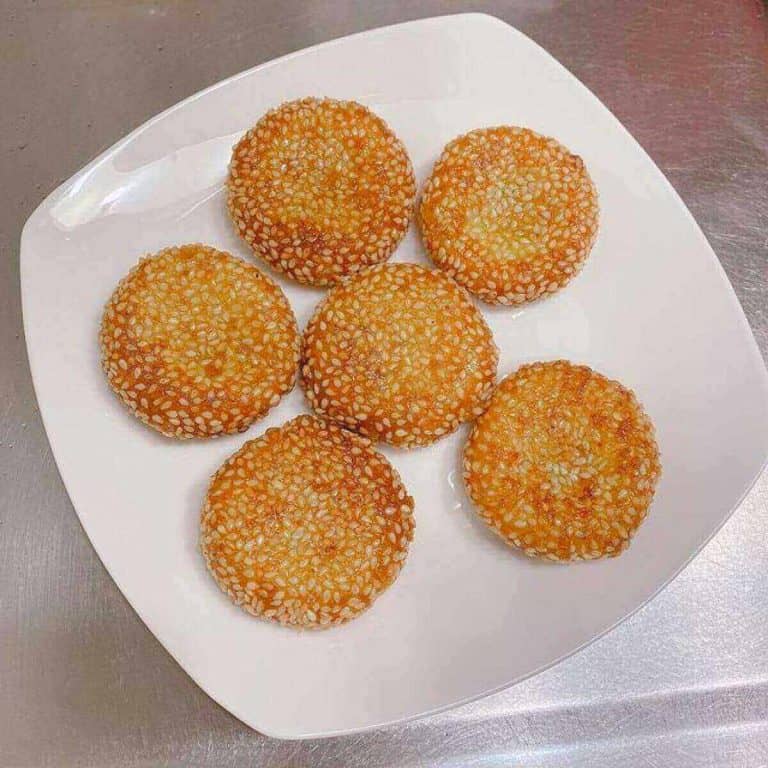
This screenshot has width=768, height=768. I want to click on metal table, so click(x=694, y=654), click(x=150, y=687).